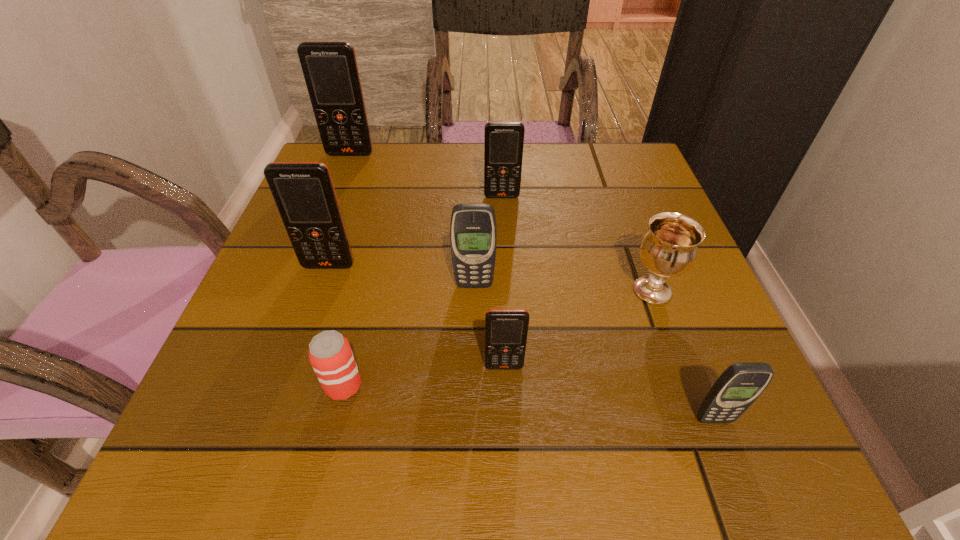
Locate an element on the screen. This screenshot has width=960, height=540. vacant space located 0.100m on the screen of the smallest orange cellular telephone is located at coordinates (507, 433).

I want to click on vacant point located 0.190m on the back of the beer can, so click(x=369, y=281).

Locate an element on the screen. The height and width of the screenshot is (540, 960). object present at the near edge is located at coordinates (737, 388).

Locate an element on the screen. chalice that is at the right edge is located at coordinates (669, 249).

Image resolution: width=960 pixels, height=540 pixels. In order to click on cellular telephone that is at the right edge in this screenshot , I will do `click(737, 388)`.

Locate an element on the screen. object located at the far left corner is located at coordinates (330, 69).

At what (x,y) coordinates should I click in order to perform the action: click on object that is at the near right corner. Please return your answer as a coordinate pair (x, y). The image size is (960, 540). Looking at the image, I should click on point(737,388).

The image size is (960, 540). I want to click on vacant space at the far edge of the desktop, so click(x=528, y=154).

The image size is (960, 540). What are the coordinates of `free space at the near edge` in the screenshot? It's located at (509, 481).

This screenshot has width=960, height=540. I want to click on blank space at the left edge of the desktop, so click(285, 395).